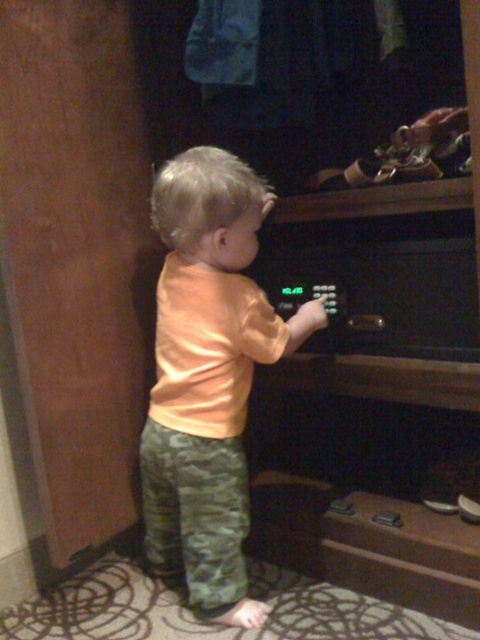
You are a delivery person who needs to place a small package on the top shelf of the furniture. The orange matte shirt at center and the green digital display at center are in your way. Which object do you need to move to access the top shelf?

The orange matte shirt at center is positioned under the green digital display at center, so you need to move the orange matte shirt at center to access the top shelf.

The scene has a child and a piece of furniture. The child is wearing a peach shirt. There is a point marked at coordinates [207,376]. What object is located at that point?

The orange matte shirt at center is located at point [207,376].